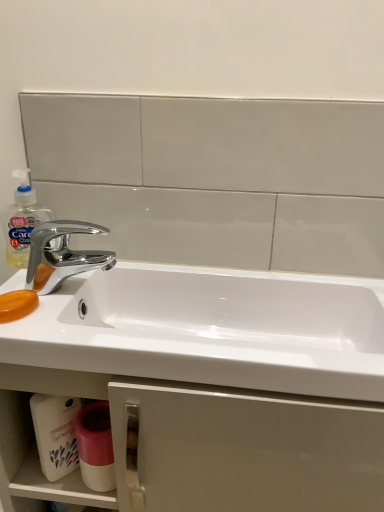
You are a GUI agent. You are given a task and a screenshot of the screen. Output one action in this format:
    pyautogui.click(x=<x>, y=<y>)
    Task: Click on the free space in front of chrome/metallic faucet at left
    
    Given the screenshot: What is the action you would take?
    pyautogui.click(x=67, y=330)